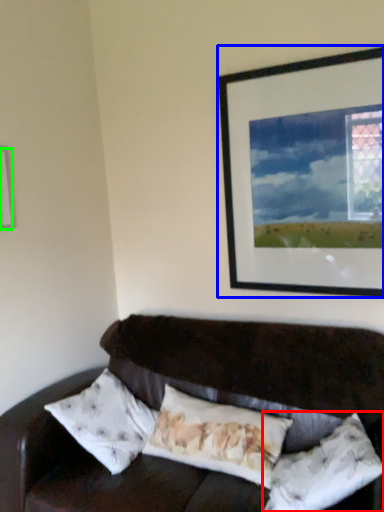
Question: Which is nearer to the pillow (highlighted by a red box)? picture frame (highlighted by a blue box) or picture frame (highlighted by a green box).

Choices:
 (A) picture frame
 (B) picture frame

Answer: (A)